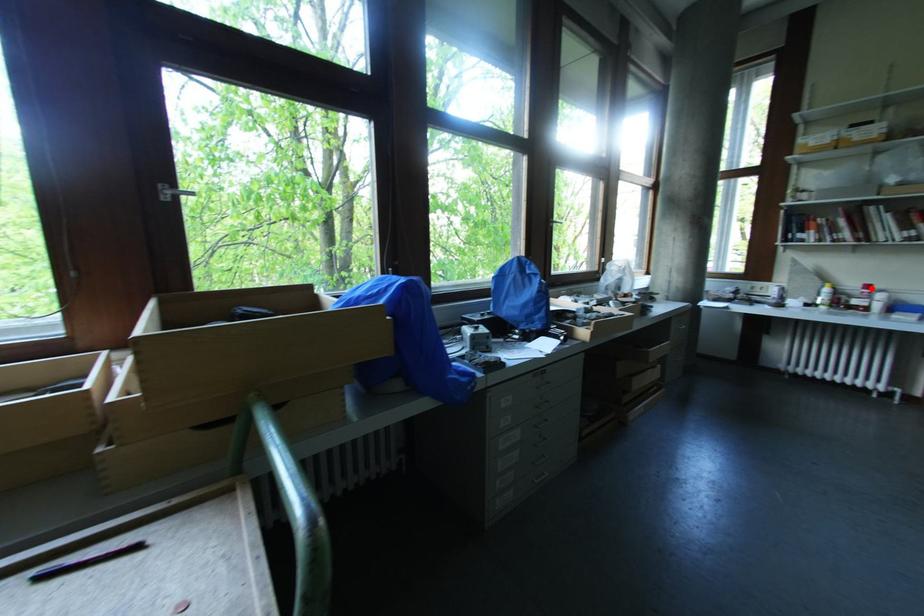
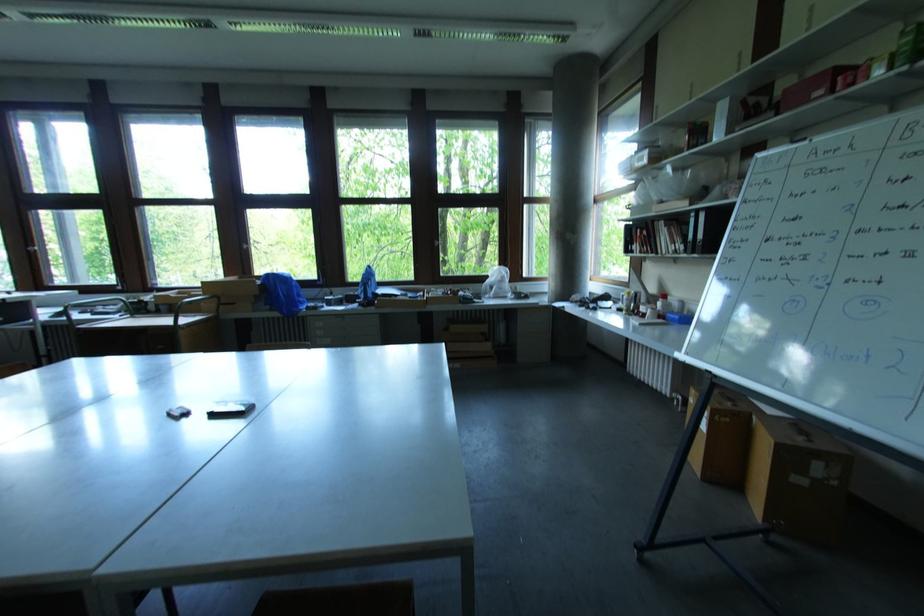
Question: I am providing you with two images of the same scene from different viewpoints. Given a red point in image1, look at the same physical point in image2. Is it:

Choices:
 (A) Closer to the viewpoint
 (B) Farther from the viewpoint

Answer: (A)